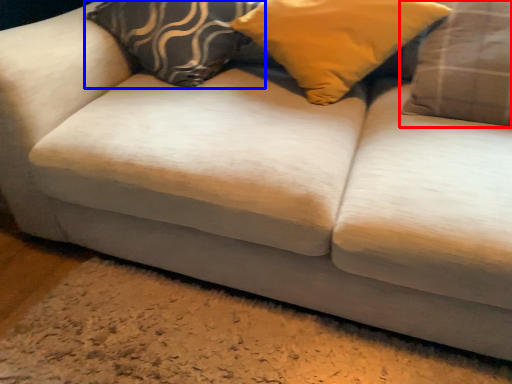
Question: Which object appears farthest to the camera in this image, pillow (highlighted by a red box) or pillow (highlighted by a blue box)?

Choices:
 (A) pillow
 (B) pillow

Answer: (B)